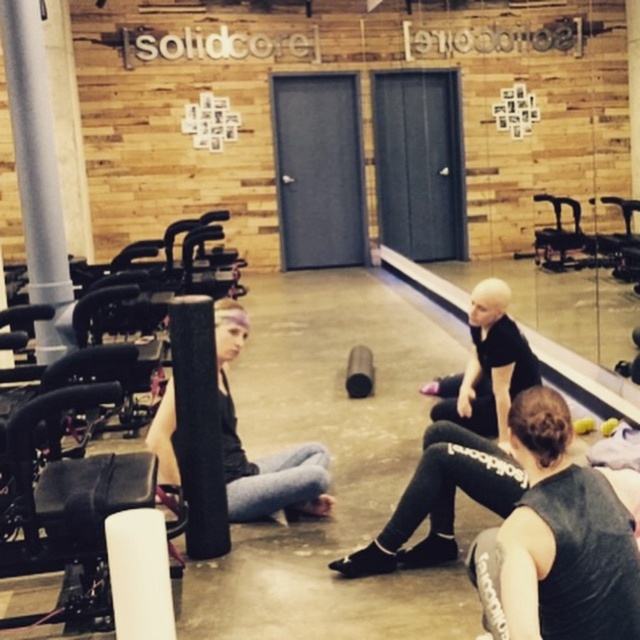
You are a participant in the fitness class and need to choose between placing your water bottle on the black matte leggings at lower right or the matte black squat at center. Which surface would provide a more stable and elevated position for your water bottle?

The matte black squat at center is taller than the black matte leggings at lower right, so placing the water bottle there would offer a more stable and elevated position.

You are standing in the gym and want to pick up the black matte leggings at lower right and the matte black squat at center. Which object should you reach for first to grab the one closer to you?

The black matte leggings at lower right is closer to the viewer, so you should reach for the black matte leggings at lower right first.